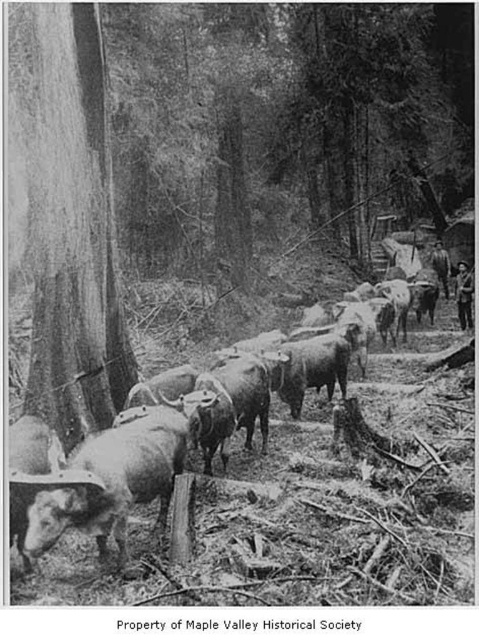
The height and width of the screenshot is (640, 479). What do you see at coordinates (66, 216) in the screenshot?
I see `smooth bark tree trunk at left` at bounding box center [66, 216].

Does smooth bark tree trunk at left have a lesser height compared to smooth gray cows at center?

Indeed, smooth bark tree trunk at left has a lesser height compared to smooth gray cows at center.

Describe the element at coordinates (66, 216) in the screenshot. The width and height of the screenshot is (479, 640). I see `smooth bark tree trunk at left` at that location.

This screenshot has height=640, width=479. Find the location of `smooth bark tree trunk at left`. smooth bark tree trunk at left is located at coordinates (66, 216).